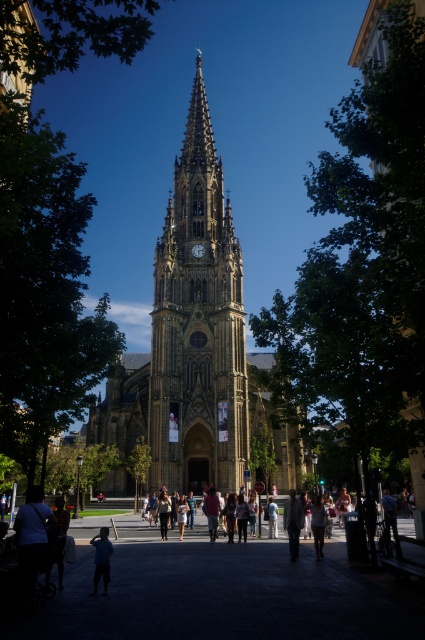
Question: Can you confirm if dark blue shirt at lower left is positioned to the right of light brown leather jacket at lower center?

Choices:
 (A) no
 (B) yes

Answer: (A)

Question: In this image, where is blue fabric shirt at lower left located relative to light blue denim jeans at center?

Choices:
 (A) left
 (B) right

Answer: (A)

Question: Which is nearer to the blue fabric shirt at lower left?

Choices:
 (A) light brown leather jacket at lower center
 (B) light blue denim jeans at center
 (C) dark brown stone clock at center
 (D) brown stone tower at center

Answer: (B)

Question: Which of the following is the closest to the observer?

Choices:
 (A) light brown leather jacket at center
 (B) dark blue shirt at lower left
 (C) light brown leather jacket at lower center
 (D) dark brown stone clock at center

Answer: (B)

Question: Estimate the real-world distances between objects in this image. Which object is closer to the dark brown stone clock at center?

Choices:
 (A) light brown leather jacket at lower center
 (B) dark blue shirt at lower left
 (C) brown stone tower at center
 (D) blue fabric shirt at lower left

Answer: (C)

Question: Is blue fabric shirt at lower left thinner than light brown leather jacket at center?

Choices:
 (A) yes
 (B) no

Answer: (B)